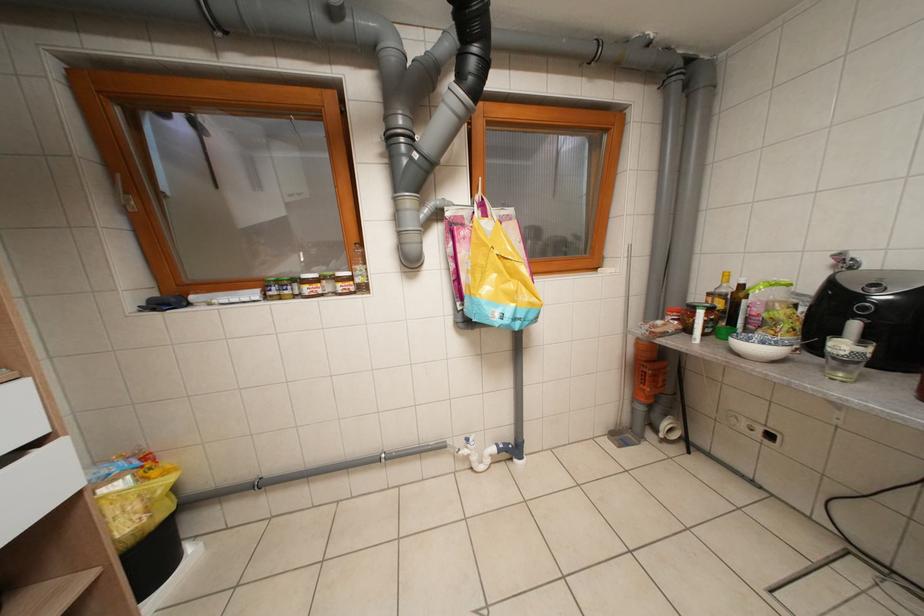
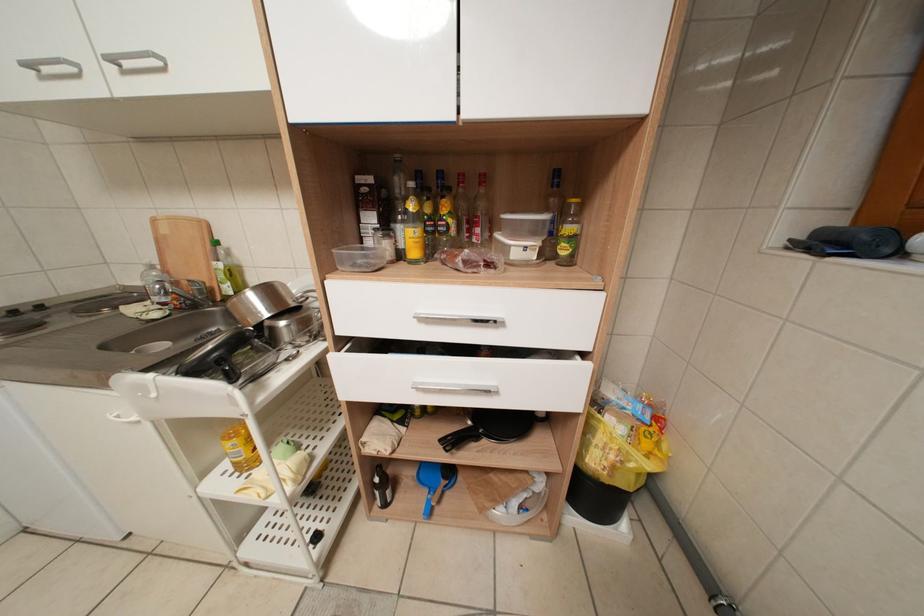
First-person continuous shooting, in which direction is the camera rotating?

The camera rotated toward left-down.